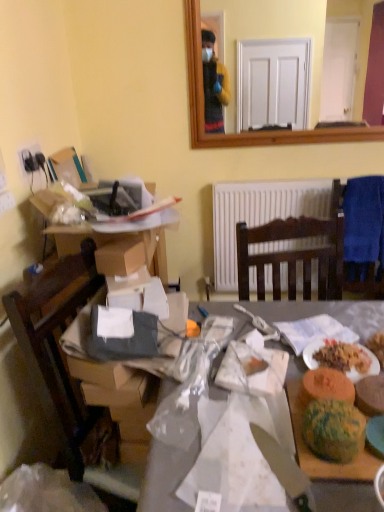
The image size is (384, 512). I want to click on vacant area on top of translucent plastic bag at center, the 2th desk viewed from the left (from a real-world perspective), so click(x=270, y=390).